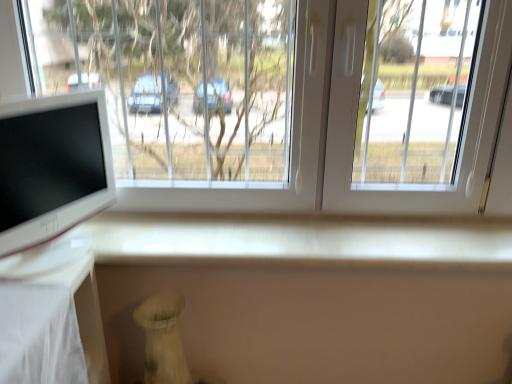
Question: From the image's perspective, is white glossy computer monitor at left on top of transparent glass window at upper center?

Choices:
 (A) no
 (B) yes

Answer: (A)

Question: Considering the relative sizes of white glossy computer monitor at left and transparent glass window at upper center in the image provided, is white glossy computer monitor at left smaller than transparent glass window at upper center?

Choices:
 (A) no
 (B) yes

Answer: (B)

Question: Does white glossy computer monitor at left have a lesser width compared to transparent glass window at upper center?

Choices:
 (A) yes
 (B) no

Answer: (A)

Question: Is white glossy computer monitor at left taller than transparent glass window at upper center?

Choices:
 (A) no
 (B) yes

Answer: (A)

Question: Considering the relative positions of white glossy computer monitor at left and transparent glass window at upper center in the image provided, is white glossy computer monitor at left to the right of transparent glass window at upper center from the viewer's perspective?

Choices:
 (A) yes
 (B) no

Answer: (B)

Question: Does white glossy computer monitor at left have a lesser height compared to transparent glass window at upper center?

Choices:
 (A) no
 (B) yes

Answer: (B)

Question: Is transparent glass window at upper center bigger than white glossy computer monitor at left?

Choices:
 (A) no
 (B) yes

Answer: (B)

Question: Can you see transparent glass window at upper center touching white glossy computer monitor at left?

Choices:
 (A) yes
 (B) no

Answer: (B)

Question: Considering the relative sizes of transparent glass window at upper center and white glossy computer monitor at left in the image provided, is transparent glass window at upper center thinner than white glossy computer monitor at left?

Choices:
 (A) yes
 (B) no

Answer: (B)

Question: Is transparent glass window at upper center smaller than white glossy computer monitor at left?

Choices:
 (A) yes
 (B) no

Answer: (B)

Question: Can you confirm if transparent glass window at upper center is positioned to the left of white glossy computer monitor at left?

Choices:
 (A) no
 (B) yes

Answer: (A)

Question: Is transparent glass window at upper center positioned before white glossy computer monitor at left?

Choices:
 (A) no
 (B) yes

Answer: (A)

Question: Is transparent glass window at upper center wider or thinner than white glossy computer monitor at left?

Choices:
 (A) thin
 (B) wide

Answer: (B)